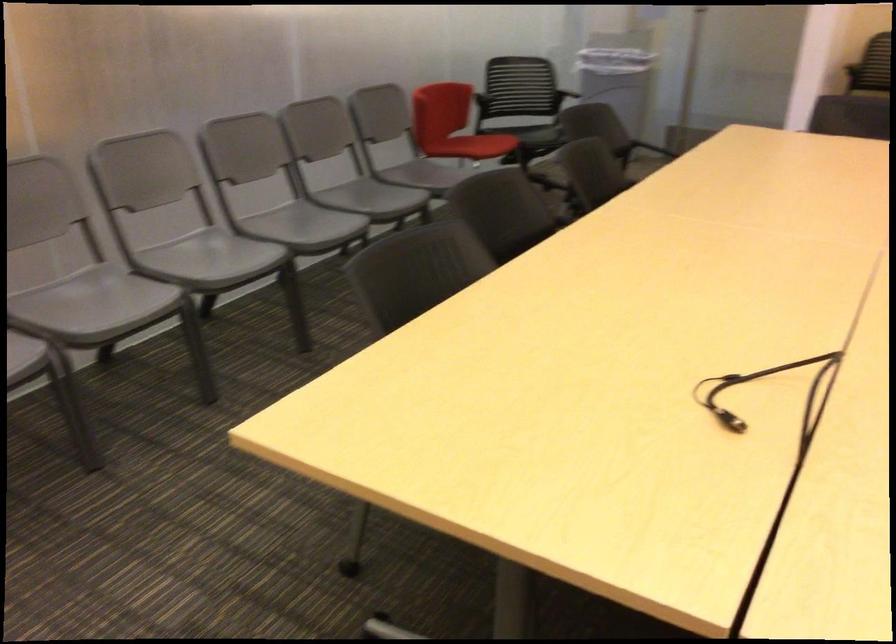
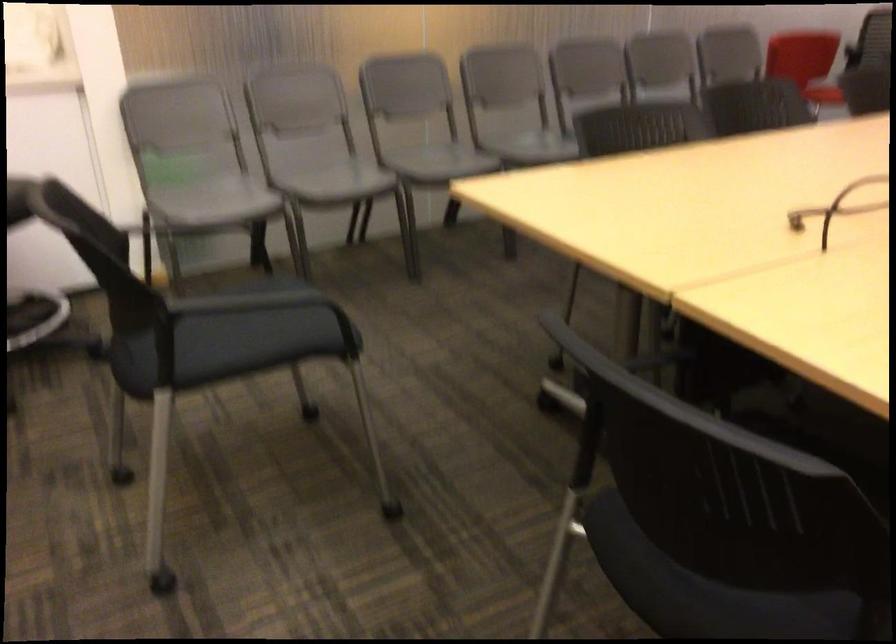
In the second image, find the point that corresponds to (100,319) in the first image.

(436, 161)